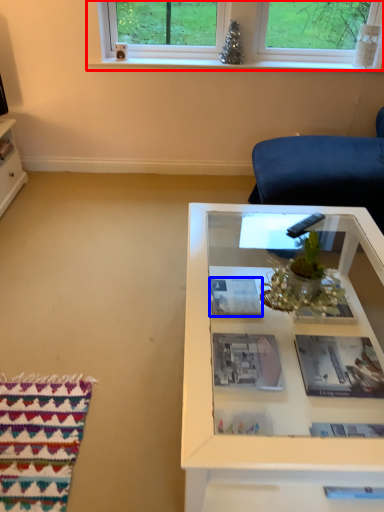
Question: Among these objects, which one is farthest to the camera, window (highlighted by a red box) or magazine (highlighted by a blue box)?

Choices:
 (A) window
 (B) magazine

Answer: (A)